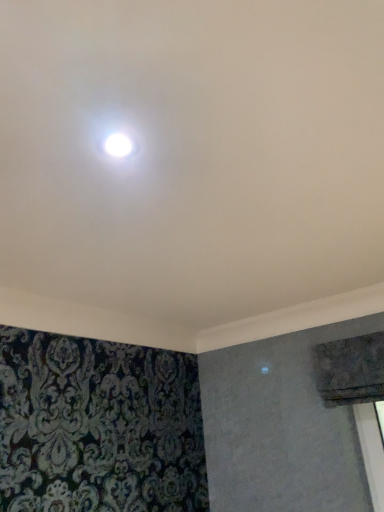
This screenshot has width=384, height=512. Identify the location of white glossy droplight at upper center. (117, 143).

Describe the element at coordinates (117, 143) in the screenshot. I see `white glossy droplight at upper center` at that location.

Where is `white glossy droplight at upper center`? The width and height of the screenshot is (384, 512). white glossy droplight at upper center is located at coordinates (117, 143).